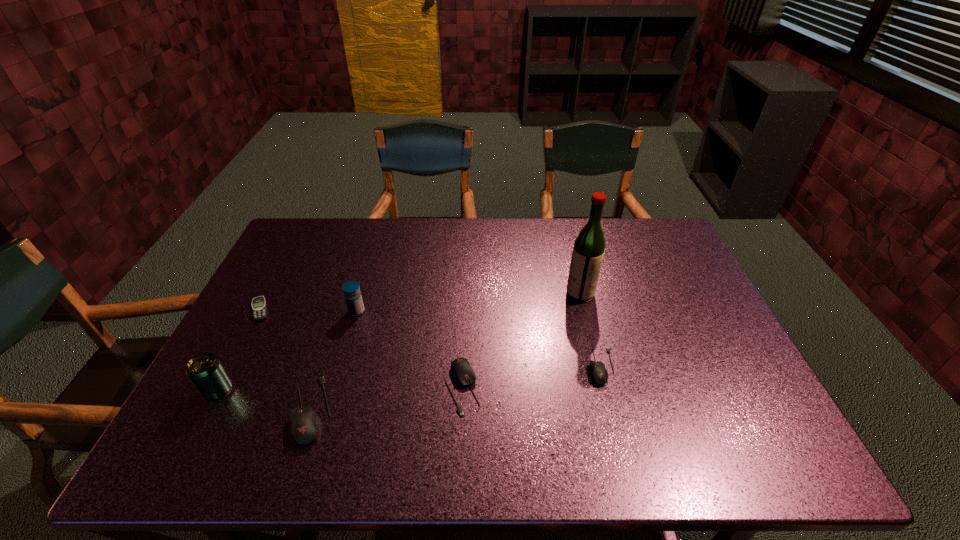
Find the location of a particular element. This screenshot has height=540, width=960. vacant region located 0.110m on the back of the second tallest mouse is located at coordinates click(x=465, y=329).

Where is `vacant space located on the back of the shortest mouse`? vacant space located on the back of the shortest mouse is located at coordinates (587, 307).

You are a GUI agent. You are given a task and a screenshot of the screen. Output one action in this format:
    pyautogui.click(x=<x>, y=<y>)
    Task: Click on the free point located 0.210m on the label of the tallest object
    
    Given the screenshot: What is the action you would take?
    pyautogui.click(x=496, y=294)

The height and width of the screenshot is (540, 960). I want to click on free location located on the label of the tallest object, so click(506, 294).

Where is `vacant space located on the label of the tallest object`? This screenshot has width=960, height=540. vacant space located on the label of the tallest object is located at coordinates (510, 294).

Locate an element on the screen. free space located 0.110m on the front of the medicine is located at coordinates (347, 348).

You are a GUI agent. You are given a task and a screenshot of the screen. Output one action in this format:
    pyautogui.click(x=<x>, y=<y>)
    Task: Click on the free space located on the right of the beer can
    Image resolution: width=960 pixels, height=540 pixels.
    Given the screenshot: What is the action you would take?
    pyautogui.click(x=391, y=390)

You are a GUI agent. You are given a task and a screenshot of the screen. Output one action in this format:
    pyautogui.click(x=<x>, y=<y>)
    Task: Click on the free location located on the front of the beeper
    
    Given the screenshot: What is the action you would take?
    pyautogui.click(x=237, y=353)

Where is `beer can that is at the near edge`? beer can that is at the near edge is located at coordinates (206, 372).

Find the location of a particular element. This screenshot has height=540, width=960. beer can at the left edge is located at coordinates (206, 372).